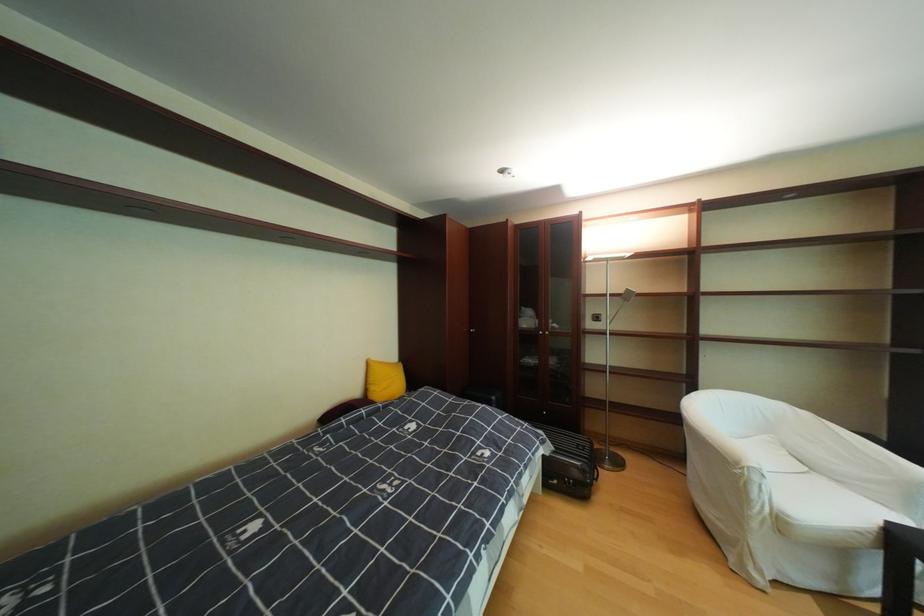
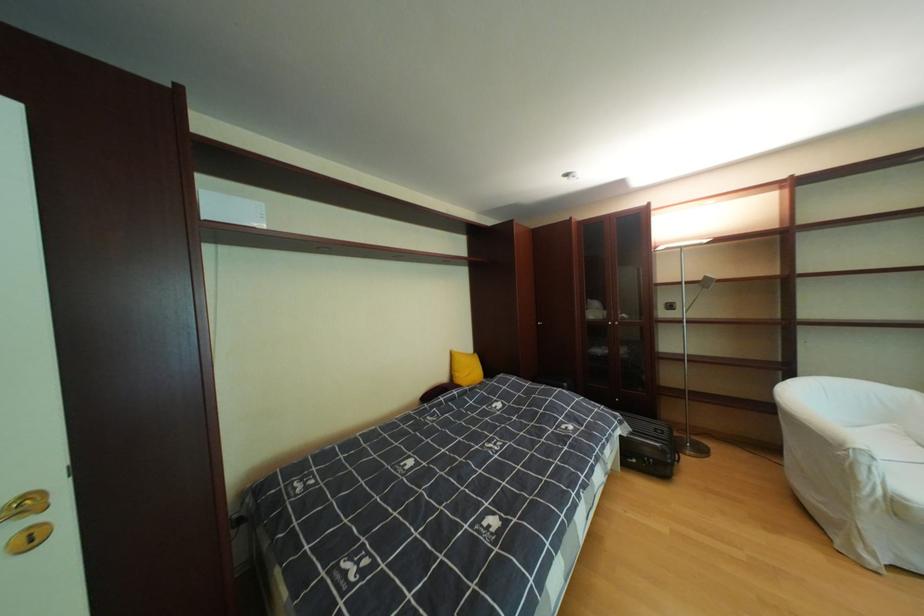
Locate, in the second image, the point that corresponds to pixel 793 523 in the first image.

(908, 506)